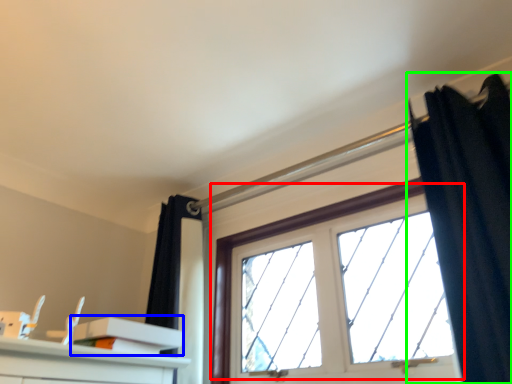
Question: Considering the real-world distances, which object is farthest from window (highlighted by a red box)? shelf (highlighted by a blue box) or curtain (highlighted by a green box)?

Choices:
 (A) shelf
 (B) curtain

Answer: (A)